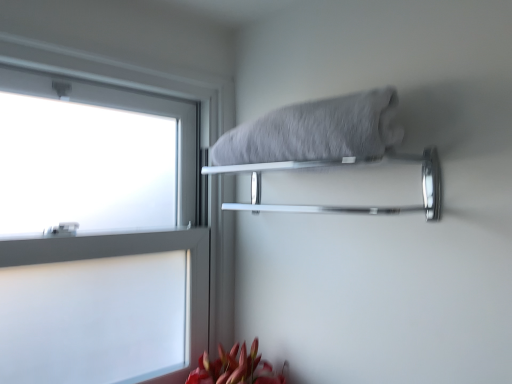
This screenshot has width=512, height=384. What do you see at coordinates (337, 166) in the screenshot?
I see `chrome metallic towel bar at upper center` at bounding box center [337, 166].

At what (x,y) coordinates should I click in order to perform the action: click on gray fluffy towel at upper center. Please return your answer as a coordinate pair (x, y). Image resolution: width=512 pixels, height=384 pixels. Looking at the image, I should click on (315, 131).

Is white frosted glass at left aimed at chrome metallic towel bar at upper center?

Yes, white frosted glass at left faces towards chrome metallic towel bar at upper center.

Choose the correct answer: Is white frosted glass at left inside chrome metallic towel bar at upper center or outside it?

white frosted glass at left is not enclosed by chrome metallic towel bar at upper center.

Between white frosted glass at left and chrome metallic towel bar at upper center, which one has larger size?

white frosted glass at left.

Where is `towel bar in front of the white frosted glass at left`? The height and width of the screenshot is (384, 512). towel bar in front of the white frosted glass at left is located at coordinates (337, 166).

From a real-world perspective, between chrome metallic towel bar at upper center and gray fluffy towel at upper center, who is vertically lower?

chrome metallic towel bar at upper center.

Find the location of a particular element. Image resolution: width=512 pixels, height=384 pixels. bath towel located above the chrome metallic towel bar at upper center (from a real-world perspective) is located at coordinates (315, 131).

Who is more distant, chrome metallic towel bar at upper center or gray fluffy towel at upper center?

chrome metallic towel bar at upper center is further from the camera.

Considering the relative sizes of chrome metallic towel bar at upper center and gray fluffy towel at upper center in the image provided, is chrome metallic towel bar at upper center thinner than gray fluffy towel at upper center?

Indeed, chrome metallic towel bar at upper center has a lesser width compared to gray fluffy towel at upper center.

Is gray fluffy towel at upper center positioned far away from chrome metallic towel bar at upper center?

gray fluffy towel at upper center is near chrome metallic towel bar at upper center, not far away.

How many degrees apart are the facing directions of gray fluffy towel at upper center and chrome metallic towel bar at upper center?

gray fluffy towel at upper center and chrome metallic towel bar at upper center are facing 0.00631 degrees away from each other.

From a real-world perspective, is gray fluffy towel at upper center beneath chrome metallic towel bar at upper center?

Incorrect, from a real-world perspective, gray fluffy towel at upper center is higher than chrome metallic towel bar at upper center.

Looking at this image, is gray fluffy towel at upper center oriented away from chrome metallic towel bar at upper center?

That's not correct — gray fluffy towel at upper center is not looking away from chrome metallic towel bar at upper center.

How different are the orientations of gray fluffy towel at upper center and white frosted glass at left in degrees?

There is a 90.1-degree angle between the facing directions of gray fluffy towel at upper center and white frosted glass at left.

Considering the relative sizes of gray fluffy towel at upper center and white frosted glass at left in the image provided, is gray fluffy towel at upper center taller than white frosted glass at left?

Incorrect, the height of gray fluffy towel at upper center is not larger of that of white frosted glass at left.

In the scene shown: Choose the correct answer: Is gray fluffy towel at upper center inside white frosted glass at left or outside it?

gray fluffy towel at upper center is located beyond the bounds of white frosted glass at left.

At what (x,y) coordinates should I click in order to perform the action: click on window on the left of gray fluffy towel at upper center. Please return your answer as a coordinate pair (x, y). Looking at the image, I should click on (98, 235).

Is gray fluffy towel at upper center at the back of white frosted glass at left?

white frosted glass at left is not turned away from gray fluffy towel at upper center.

From the picture: Who is smaller, white frosted glass at left or gray fluffy towel at upper center?

Smaller between the two is gray fluffy towel at upper center.

In terms of height, does white frosted glass at left look taller or shorter compared to gray fluffy towel at upper center?

In the image, white frosted glass at left appears to be taller than gray fluffy towel at upper center.

Are white frosted glass at left and gray fluffy towel at upper center beside each other?

white frosted glass at left is not next to gray fluffy towel at upper center, and they're not touching.

Would you say chrome metallic towel bar at upper center is inside or outside white frosted glass at left?

chrome metallic towel bar at upper center lies outside white frosted glass at left.

Consider the image. Are chrome metallic towel bar at upper center and white frosted glass at left far apart?

No.

From a real-world perspective, between chrome metallic towel bar at upper center and white frosted glass at left, who is vertically lower?

white frosted glass at left, from a real-world perspective.

Is chrome metallic towel bar at upper center shorter than white frosted glass at left?

Yes, chrome metallic towel bar at upper center is shorter than white frosted glass at left.

Find the location of `towel bar above the white frosted glass at left (from a real-world perspective)`. towel bar above the white frosted glass at left (from a real-world perspective) is located at coordinates (337, 166).

Identify the location of towel bar on the left of the gray fluffy towel at upper center. The height and width of the screenshot is (384, 512). (337, 166).

Considering their positions, is white frosted glass at left positioned further to chrome metallic towel bar at upper center than gray fluffy towel at upper center?

white frosted glass at left lies further to chrome metallic towel bar at upper center than the other object.

When comparing their distances from chrome metallic towel bar at upper center, does gray fluffy towel at upper center or white frosted glass at left seem further?

white frosted glass at left lies further to chrome metallic towel bar at upper center than the other object.

When comparing their distances from white frosted glass at left, does chrome metallic towel bar at upper center or gray fluffy towel at upper center seem further?

The object further to white frosted glass at left is gray fluffy towel at upper center.

Based on their spatial positions, is chrome metallic towel bar at upper center or white frosted glass at left closer to gray fluffy towel at upper center?

Based on the image, chrome metallic towel bar at upper center appears to be nearer to gray fluffy towel at upper center.

From the image, which object appears to be farther from gray fluffy towel at upper center, white frosted glass at left or chrome metallic towel bar at upper center?

white frosted glass at left.

Estimate the real-world distances between objects in this image. Which object is further from white frosted glass at left, gray fluffy towel at upper center or chrome metallic towel bar at upper center?

Based on the image, gray fluffy towel at upper center appears to be further to white frosted glass at left.

Locate an element on the screen. This screenshot has height=384, width=512. towel bar between white frosted glass at left and gray fluffy towel at upper center is located at coordinates pos(337,166).